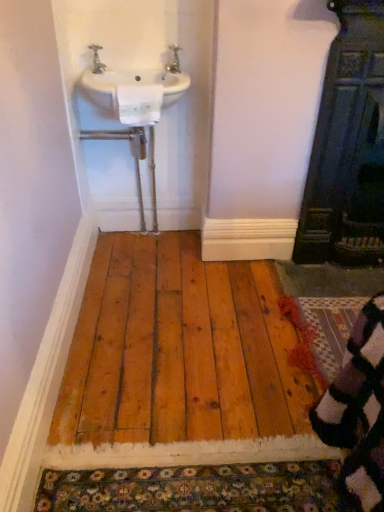
Question: Does multicolored knitted rug at lower right appear on the right side of silver metallic tap at upper center, which is counted as the second tap, starting from the left?

Choices:
 (A) yes
 (B) no

Answer: (A)

Question: Is multicolored knitted rug at lower right thinner than silver metallic tap at upper center, the first tap in the right-to-left sequence?

Choices:
 (A) yes
 (B) no

Answer: (B)

Question: Does multicolored knitted rug at lower right touch silver metallic tap at upper center, which is counted as the second tap, starting from the left?

Choices:
 (A) no
 (B) yes

Answer: (A)

Question: Considering the relative sizes of multicolored knitted rug at lower right and silver metallic tap at upper center, the first tap in the right-to-left sequence, in the image provided, is multicolored knitted rug at lower right wider than silver metallic tap at upper center, the first tap in the right-to-left sequence,?

Choices:
 (A) yes
 (B) no

Answer: (A)

Question: From the image's perspective, does multicolored knitted rug at lower right appear lower than silver metallic tap at upper center, the first tap in the right-to-left sequence?

Choices:
 (A) no
 (B) yes

Answer: (B)

Question: In the image, is metallic silver faucet at upper left, acting as the second tap starting from the right, positioned in front of or behind multicolored knitted rug at lower right?

Choices:
 (A) behind
 (B) front

Answer: (A)

Question: Is metallic silver faucet at upper left, acting as the second tap starting from the right, inside or outside of multicolored knitted rug at lower right?

Choices:
 (A) outside
 (B) inside

Answer: (A)

Question: Considering the positions of metallic silver faucet at upper left, acting as the second tap starting from the right, and multicolored knitted rug at lower right in the image, is metallic silver faucet at upper left, acting as the second tap starting from the right, taller or shorter than multicolored knitted rug at lower right?

Choices:
 (A) short
 (B) tall

Answer: (B)

Question: Is point (99, 46) closer or farther from the camera than point (322, 350)?

Choices:
 (A) closer
 (B) farther

Answer: (B)

Question: In the image, is white ceramic sink at upper left positioned in front of or behind silver metallic tap at upper center, which is counted as the second tap, starting from the left?

Choices:
 (A) front
 (B) behind

Answer: (A)

Question: In terms of size, does white ceramic sink at upper left appear bigger or smaller than silver metallic tap at upper center, the first tap in the right-to-left sequence?

Choices:
 (A) small
 (B) big

Answer: (B)

Question: From their relative heights in the image, would you say white ceramic sink at upper left is taller or shorter than silver metallic tap at upper center, which is counted as the second tap, starting from the left?

Choices:
 (A) short
 (B) tall

Answer: (B)

Question: Looking at their shapes, would you say white ceramic sink at upper left is wider or thinner than silver metallic tap at upper center, which is counted as the second tap, starting from the left?

Choices:
 (A) wide
 (B) thin

Answer: (A)

Question: From the image's perspective, relative to white ceramic sink at upper left, is multicolored knitted rug at lower right above or below?

Choices:
 (A) below
 (B) above

Answer: (A)

Question: Is multicolored knitted rug at lower right in front of or behind white ceramic sink at upper left in the image?

Choices:
 (A) front
 (B) behind

Answer: (A)